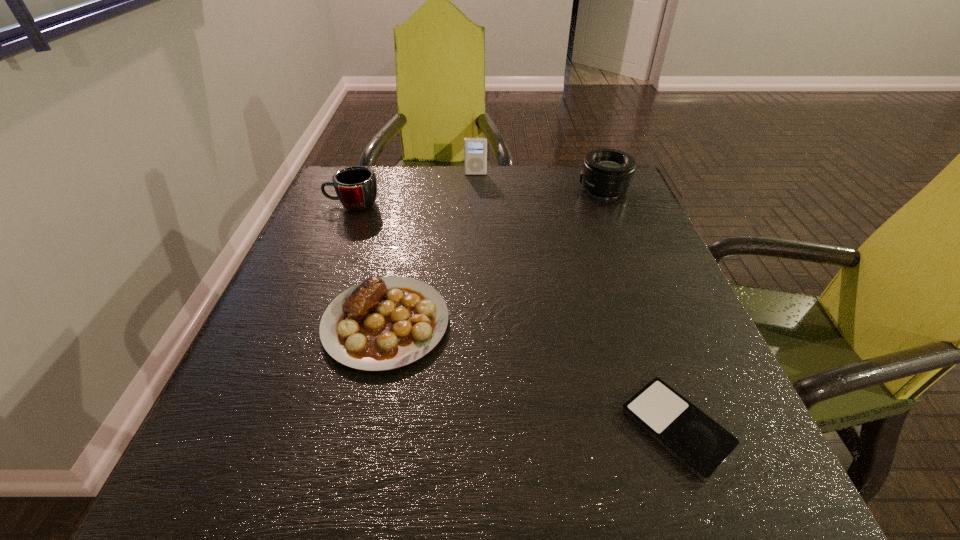
Locate an element on the screen. This screenshot has width=960, height=540. vacant point located on the side of the telephoto lens with brand markings and control switches is located at coordinates (485, 189).

The height and width of the screenshot is (540, 960). Identify the location of vacant space located 0.060m on the side of the telephoto lens with brand markings and control switches. (556, 189).

Locate an element on the screen. The height and width of the screenshot is (540, 960). blank space located 0.110m on the right of the steak is located at coordinates (508, 323).

This screenshot has height=540, width=960. I want to click on free space located on the left of the nearest object, so click(x=572, y=428).

I want to click on iPod that is at the far edge, so click(x=475, y=149).

This screenshot has width=960, height=540. I want to click on telephoto lens that is at the far edge, so click(x=607, y=173).

You are a GUI agent. You are given a task and a screenshot of the screen. Output one action in this format:
    pyautogui.click(x=<x>, y=<y>)
    Task: Click on the mug present at the far edge
    
    Given the screenshot: What is the action you would take?
    point(356,187)

Where is `object that is at the near edge`? object that is at the near edge is located at coordinates (701, 444).

The width and height of the screenshot is (960, 540). I want to click on mug positioned at the left edge, so click(356, 187).

The width and height of the screenshot is (960, 540). Find the location of `steak that is positioned at the left edge`. steak that is positioned at the left edge is located at coordinates (383, 323).